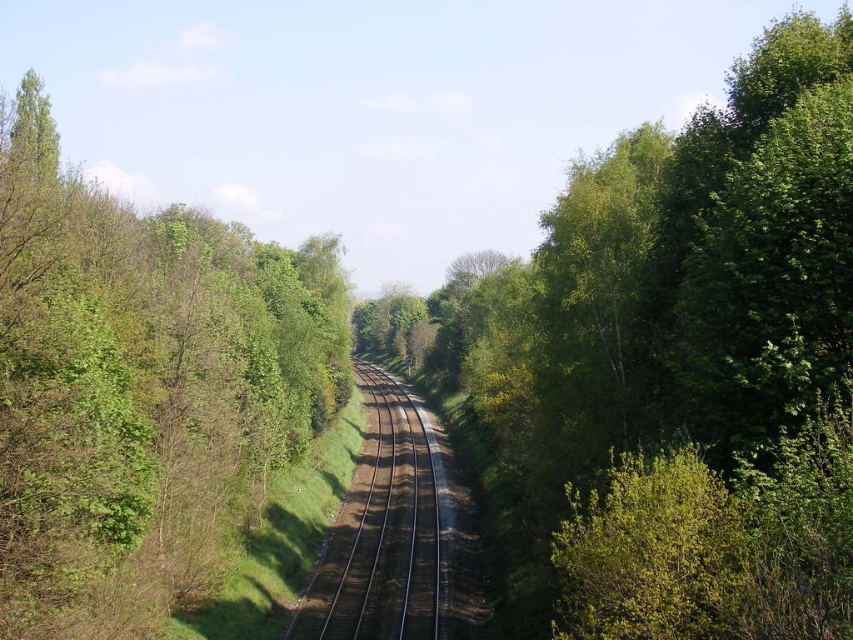
Question: Which point appears farthest from the camera in this image?

Choices:
 (A) (259, 348)
 (B) (390, 577)

Answer: (A)

Question: Is green leafy tree at left smaller than brown/gravel track at center?

Choices:
 (A) yes
 (B) no

Answer: (B)

Question: Is green leafy tree at left bigger than brown/gravel track at center?

Choices:
 (A) no
 (B) yes

Answer: (B)

Question: Can you confirm if green leafy tree at left is thinner than brown/gravel track at center?

Choices:
 (A) no
 (B) yes

Answer: (A)

Question: Which point appears farthest from the camera in this image?

Choices:
 (A) (260, 328)
 (B) (398, 387)

Answer: (B)